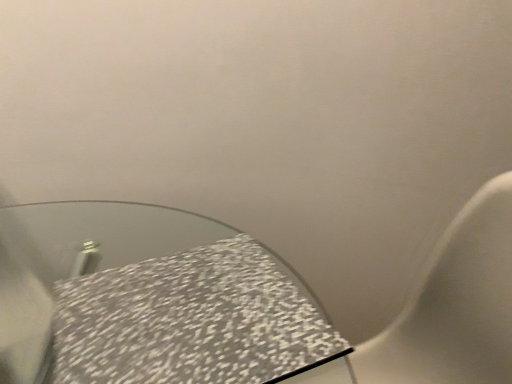
Question: In terms of height, does speckled fabric tablecloth at lower left look taller or shorter compared to speckled ceramic toilet at lower left?

Choices:
 (A) tall
 (B) short

Answer: (B)

Question: Considering the positions of speckled fabric tablecloth at lower left and speckled ceramic toilet at lower left in the image, is speckled fabric tablecloth at lower left wider or thinner than speckled ceramic toilet at lower left?

Choices:
 (A) wide
 (B) thin

Answer: (B)

Question: Is speckled fabric tablecloth at lower left spatially inside speckled ceramic toilet at lower left, or outside of it?

Choices:
 (A) inside
 (B) outside

Answer: (A)

Question: From the image's perspective, is speckled ceramic toilet at lower left above or below speckled fabric tablecloth at lower left?

Choices:
 (A) above
 (B) below

Answer: (B)

Question: Is speckled ceramic toilet at lower left wider or thinner than speckled fabric tablecloth at lower left?

Choices:
 (A) thin
 (B) wide

Answer: (B)

Question: From their relative heights in the image, would you say speckled ceramic toilet at lower left is taller or shorter than speckled fabric tablecloth at lower left?

Choices:
 (A) short
 (B) tall

Answer: (B)

Question: Relative to speckled fabric tablecloth at lower left, is speckled ceramic toilet at lower left in front or behind?

Choices:
 (A) behind
 (B) front

Answer: (B)